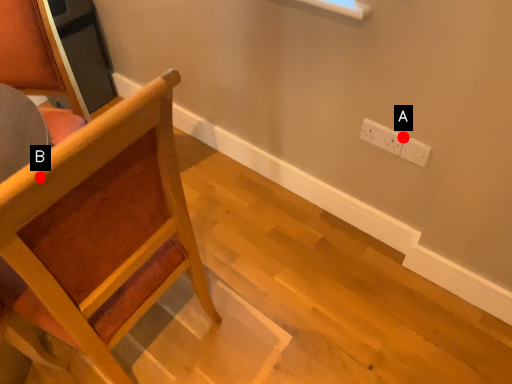
Question: Two points are circled on the image, labeled by A and B beside each circle. Among these points, which one is nearest to the camera?

Choices:
 (A) A is closer
 (B) B is closer

Answer: (B)